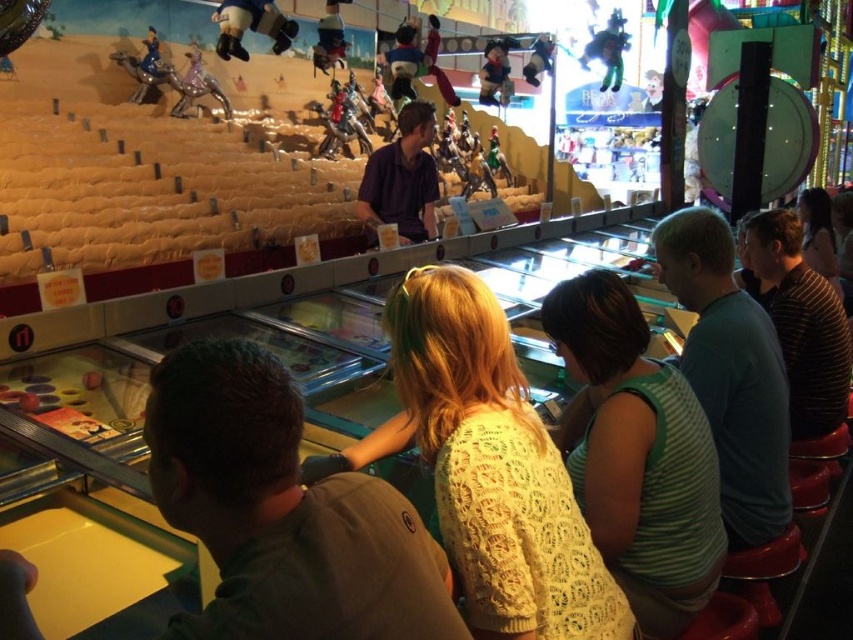
You are a photographer trying to capture a candid shot of both the light brown sweater at center and the green striped tank top at center from above. Which clothing item should you focus on first to ensure both are in frame?

The light brown sweater at center is below the green striped tank top at center, so you should focus on the green striped tank top at center first to ensure both are in frame.

You are standing in the arcade and notice two people wearing the green striped shirt at right and the purple cotton shirt at center. Which person is nearer to you?

The green striped shirt at right is closer to the viewer than the purple cotton shirt at center, so the person wearing the green striped shirt at right is nearer to you.